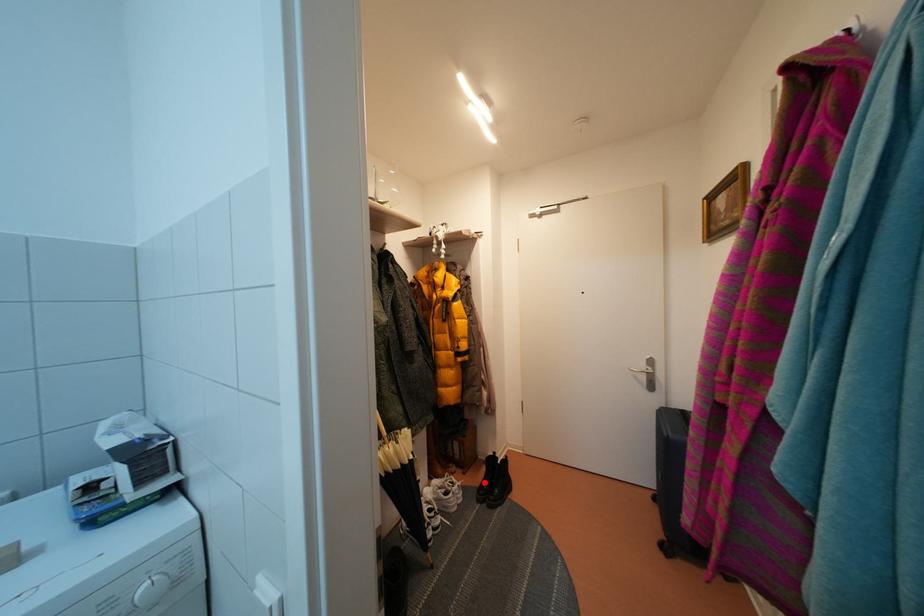
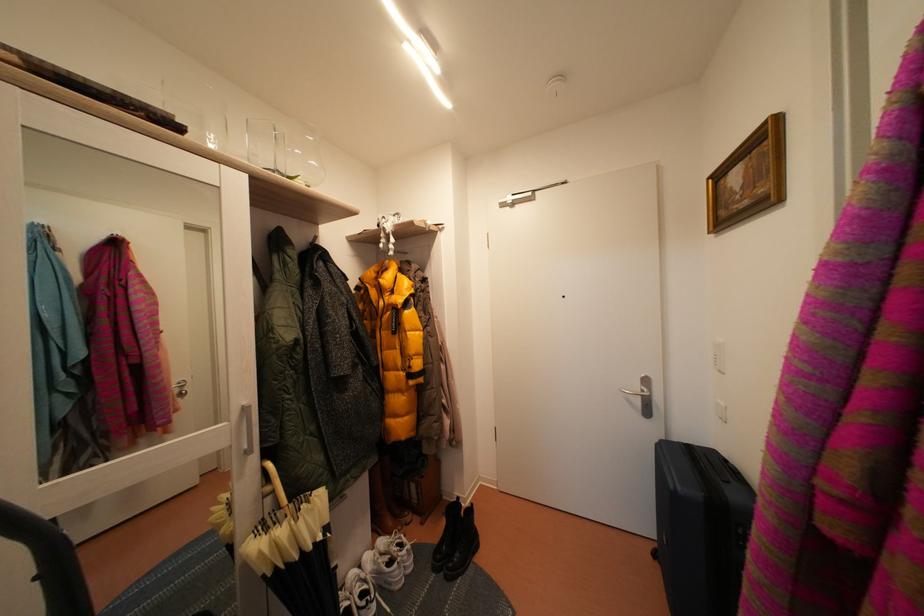
Find the pixel in the second image that matches the highlighted location in the first image.

(444, 536)